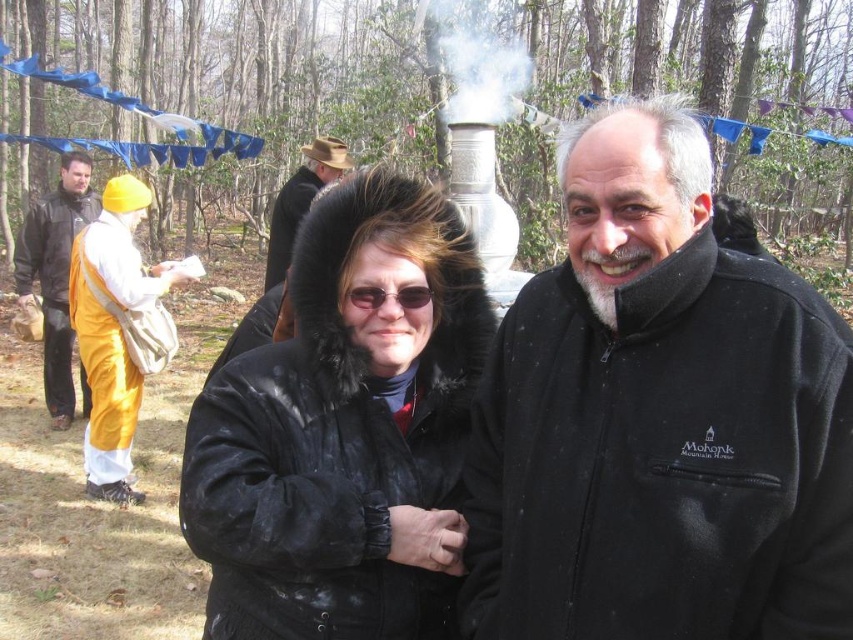
You are a photographer trying to capture both the black fleece jacket at center and the black leather jacket at center in a single shot. Which jacket should you focus on first to ensure the one behind is also in focus?

The black fleece jacket at center is in front of the black leather jacket at center. To ensure both are in focus, focus on the black fleece jacket at center first since it is closer to the camera.

You are a photographer trying to capture the orange fabric turban at left and the brown felt hat at upper center in the same frame. Which object should you focus on first to ensure both are in focus?

The orange fabric turban at left is in front of the brown felt hat at upper center, so you should focus on the orange fabric turban at left first to ensure both are in focus.

You are a photographer trying to capture a clear shot of both the black fleece jacket at center and the brown felt hat at upper center. Which object should you focus on first to ensure both are in focus?

The black fleece jacket at center is closer to the viewer than the brown felt hat at upper center. To ensure both are in focus, you should focus on the black fleece jacket at center first, as it is closer, and the depth of field may extend to the hat if properly adjusted.